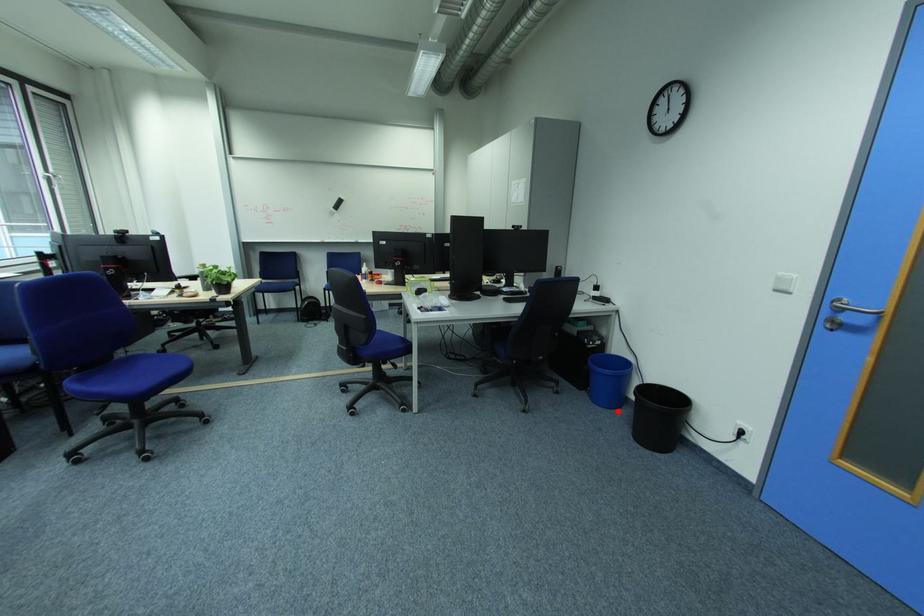
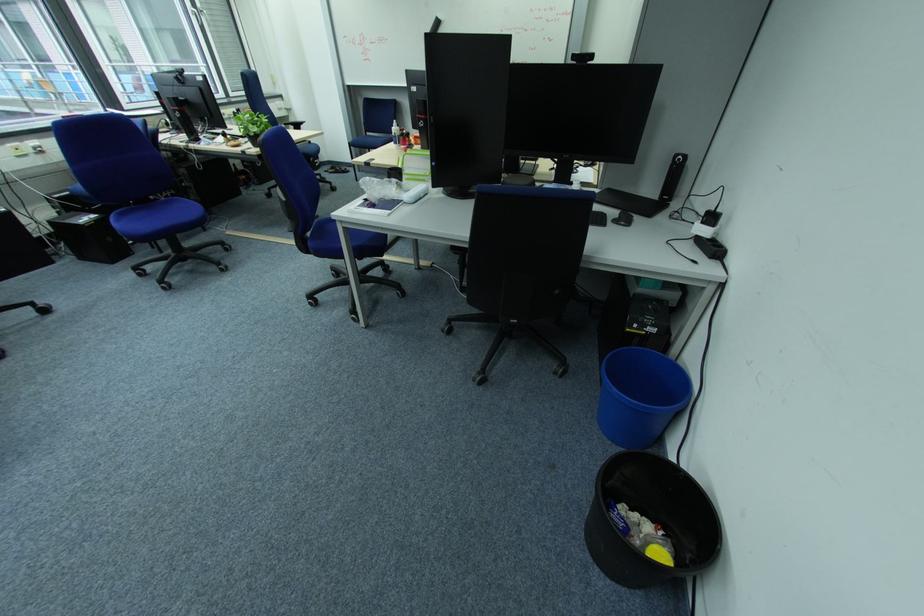
Where in the second image is the point corresponding to the highlighted location from the first image?

(618, 444)